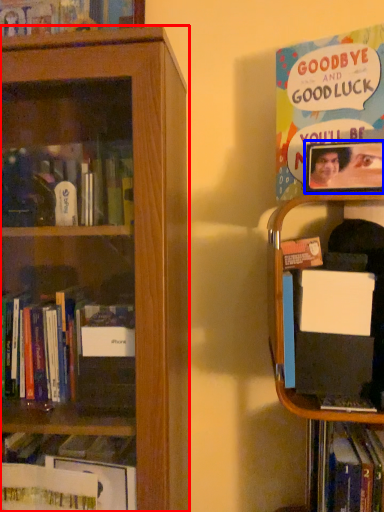
Question: Which of the following is the farthest to the observer, bookcase (highlighted by a red box) or picture frame (highlighted by a blue box)?

Choices:
 (A) bookcase
 (B) picture frame

Answer: (B)